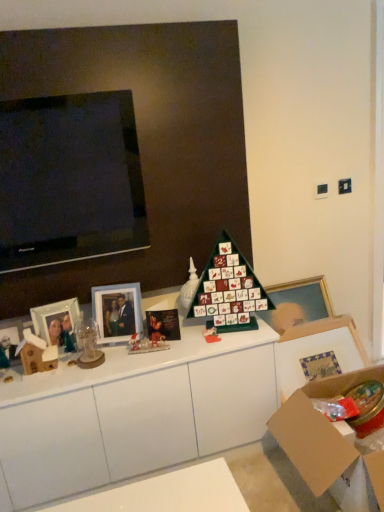
Question: Considering their positions, is green matte advent calendar at center located in front of or behind matte glass picture frame at center left, acting as the third picture frame starting from the left?

Choices:
 (A) behind
 (B) front

Answer: (B)

Question: Considering the positions of point (220, 259) and point (137, 287), is point (220, 259) closer or farther from the camera than point (137, 287)?

Choices:
 (A) farther
 (B) closer

Answer: (B)

Question: Estimate the real-world distances between objects in this image. Which object is farther from the wooden picture frame at left, the 4th picture frame viewed from the right?

Choices:
 (A) cardboard box at lower right
 (B) white glossy cabinet at center
 (C) matte glass photo frame at left, marked as the 2th picture frame in a left-to-right arrangement
 (D) matte gold picture frame at lower right, placed as the first picture frame when sorted from right to left
 (E) matte glass picture frame at center left, positioned as the 2th picture frame in right-to-left order

Answer: (D)

Question: Considering the real-world distances, which object is closest to the green matte advent calendar at center?

Choices:
 (A) white glossy cabinet at center
 (B) cardboard box at lower right
 (C) matte glass picture frame at center left, positioned as the 2th picture frame in right-to-left order
 (D) wooden picture frame at left, the 1th picture frame viewed from the left
 (E) glossy paper christmas card at center

Answer: (E)